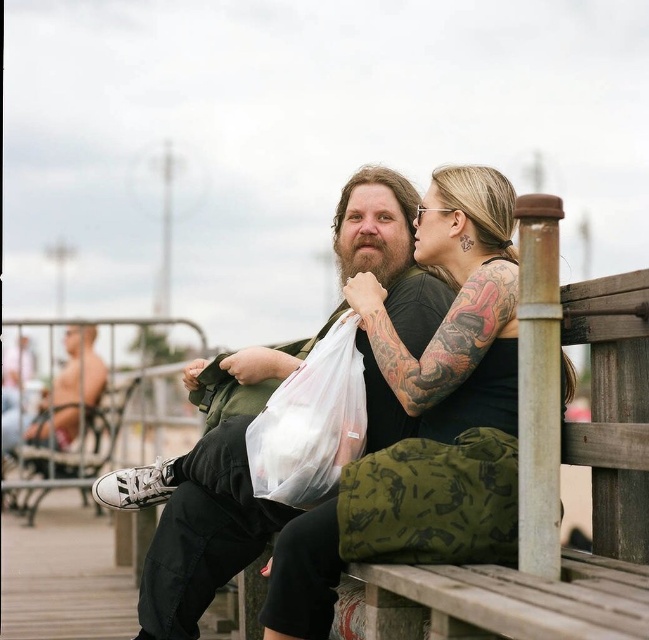
Question: Can you confirm if green canvas jacket at center is bigger than camouflage fabric bag at lower right?

Choices:
 (A) no
 (B) yes

Answer: (B)

Question: Which of the following is the closest to the observer?

Choices:
 (A) black matte tank top at center
 (B) white plastic bag at lower left

Answer: (A)

Question: Does green canvas jacket at center appear over transparent plastic bag at center?

Choices:
 (A) no
 (B) yes

Answer: (B)

Question: Is black matte tank top at center to the left of transparent plastic bag at center from the viewer's perspective?

Choices:
 (A) no
 (B) yes

Answer: (A)

Question: Which of the following is the farthest from the observer?

Choices:
 (A) transparent plastic bag at center
 (B) black matte tank top at center
 (C) camouflage fabric bag at lower right

Answer: (A)

Question: Which object appears closest to the camera in this image?

Choices:
 (A) camouflage fabric bag at lower right
 (B) green canvas jacket at center
 (C) transparent plastic bag at center
 (D) black matte tank top at center

Answer: (A)